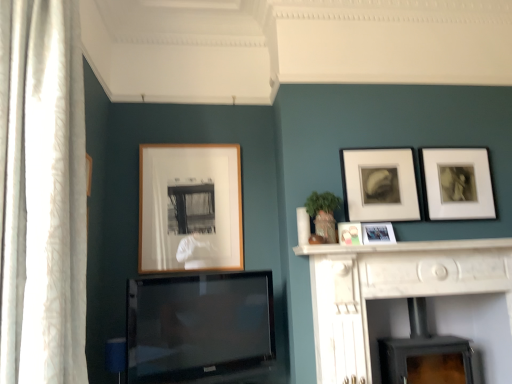
Question: Could you tell me if flat-screen tv at center is turned towards black matte wood burning stove at lower center?

Choices:
 (A) no
 (B) yes

Answer: (A)

Question: From a real-world perspective, is flat-screen tv at center under black matte wood burning stove at lower center?

Choices:
 (A) no
 (B) yes

Answer: (A)

Question: From the image's perspective, is flat-screen tv at center on top of black matte wood burning stove at lower center?

Choices:
 (A) yes
 (B) no

Answer: (A)

Question: From the image's perspective, is flat-screen tv at center under black matte wood burning stove at lower center?

Choices:
 (A) no
 (B) yes

Answer: (A)

Question: Does flat-screen tv at center have a lesser width compared to black matte wood burning stove at lower center?

Choices:
 (A) yes
 (B) no

Answer: (A)

Question: From the image's perspective, is wooden frame at center, which appears as the first picture frame when viewed from the left, located above or below metallic silver photo frame at center-right, positioned as the 3th picture frame in left-to-right order?

Choices:
 (A) below
 (B) above

Answer: (B)

Question: Considering their positions, is wooden frame at center, positioned as the fifth picture frame in right-to-left order, located in front of or behind metallic silver photo frame at center-right, which appears as the third picture frame when viewed from the right?

Choices:
 (A) behind
 (B) front

Answer: (A)

Question: Would you say wooden frame at center, positioned as the fifth picture frame in right-to-left order, is to the left or to the right of metallic silver photo frame at center-right, which appears as the third picture frame when viewed from the right, in the picture?

Choices:
 (A) right
 (B) left

Answer: (B)

Question: In terms of height, does wooden frame at center, positioned as the fifth picture frame in right-to-left order, look taller or shorter compared to metallic silver photo frame at center-right, positioned as the 3th picture frame in left-to-right order?

Choices:
 (A) short
 (B) tall

Answer: (B)

Question: Considering their positions, is matte black picture frame at upper right, which ranks as the 5th picture frame in left-to-right order, located in front of or behind white sheer curtain at left?

Choices:
 (A) front
 (B) behind

Answer: (B)

Question: From a real-world perspective, is matte black picture frame at upper right, which ranks as the 5th picture frame in left-to-right order, above or below white sheer curtain at left?

Choices:
 (A) below
 (B) above

Answer: (B)

Question: From the image's perspective, relative to white sheer curtain at left, is matte black picture frame at upper right, which ranks as the 5th picture frame in left-to-right order, above or below?

Choices:
 (A) above
 (B) below

Answer: (B)

Question: Is matte black picture frame at upper right, which ranks as the 5th picture frame in left-to-right order, inside or outside of white sheer curtain at left?

Choices:
 (A) inside
 (B) outside

Answer: (B)

Question: In the image, is white marble fireplace at center positioned in front of or behind matte black picture frame at upper right, placed as the fourth picture frame when sorted from left to right?

Choices:
 (A) behind
 (B) front

Answer: (B)

Question: Looking at the image, does white marble fireplace at center seem bigger or smaller compared to matte black picture frame at upper right, placed as the fourth picture frame when sorted from left to right?

Choices:
 (A) small
 (B) big

Answer: (B)